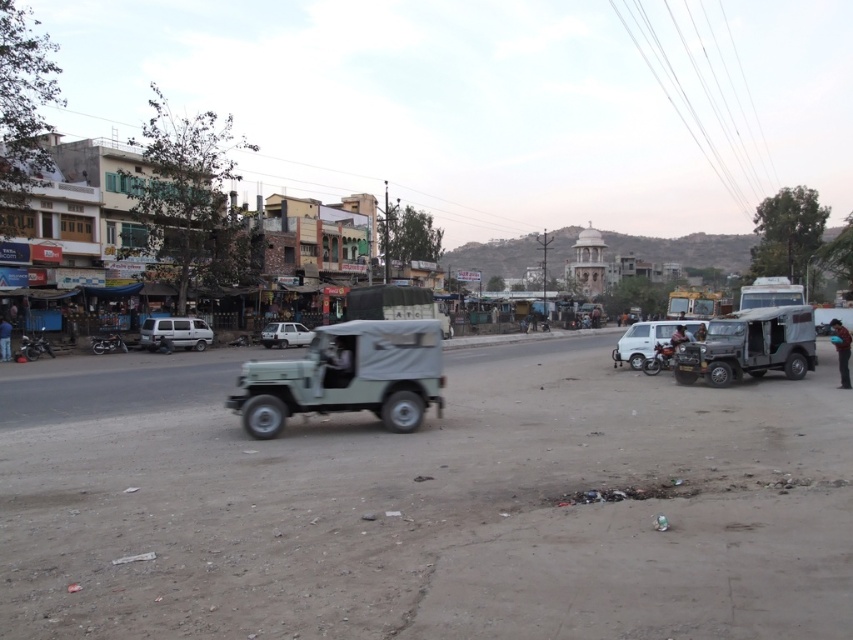
Consider the image. You are a pedestrian standing on the dirt road and see both the light green canvas jeep at center and the matte green jeep at center. Which vehicle is closer to the left side of the road?

The light green canvas jeep at center is positioned on the left side of the matte green jeep at center, so it is closer to the left side of the road.

You are standing at the point labeled point (x=722, y=342) in the image. You want to cross the street to reach the parked white van and truck in the midground. Given that the road has scattered debris and the light green jeep is moving towards the left, is it safe to cross the road right now? Please explain your reasoning based on the scene description and the distance between you and the parked vehicles.

The point labeled point (x=722, y=342) is 65.59 feet away from the viewer. Since the road has scattered debris and the light green jeep is moving towards the left, it is not safe to cross the road right now. The distance to the parked vehicles is significant, and the moving vehicle poses a risk.